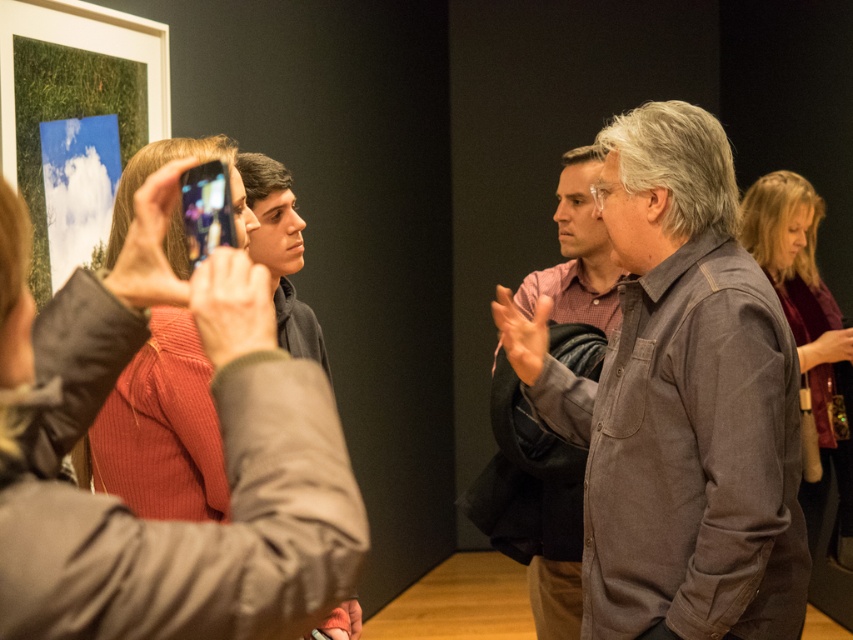
You are organizing a photo shoot and need to ensure that the ribbed sweater at center and denim shirt at center are both visible in the frame. Based on their sizes in the image, which clothing item requires more space to fully capture in the photo?

The denim shirt at center requires more space to fully capture in the photo because it occupies more space than the ribbed sweater at center.

You are an observer standing in the art gallery. You notice two shirts at the center of the scene. The brown cotton shirt at center and the denim shirt at center. Which shirt is positioned higher in the image?

The brown cotton shirt at center is located above the denim shirt at center, so it is positioned higher in the image.